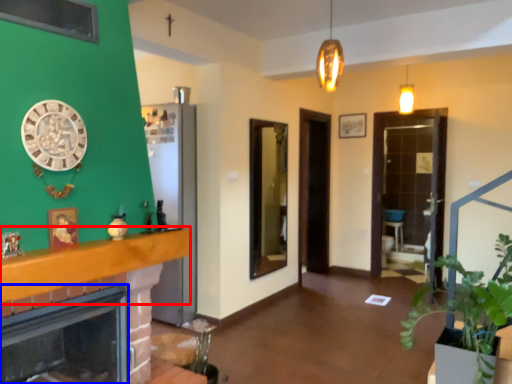
Question: Which of the following is the closest to the observer, balustrade (highlighted by a red box) or fireplace (highlighted by a blue box)?

Choices:
 (A) balustrade
 (B) fireplace

Answer: (A)